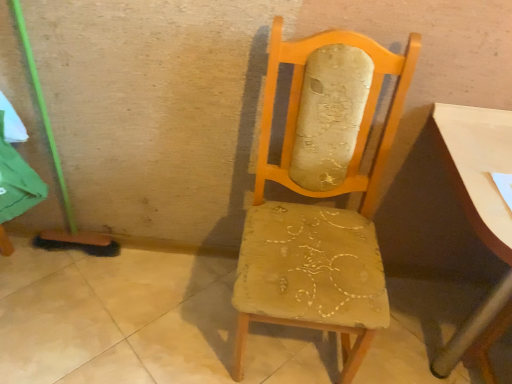
Image resolution: width=512 pixels, height=384 pixels. Find the location of `vacant space that is to the left of wooden upholstered chair at center`. vacant space that is to the left of wooden upholstered chair at center is located at coordinates (181, 316).